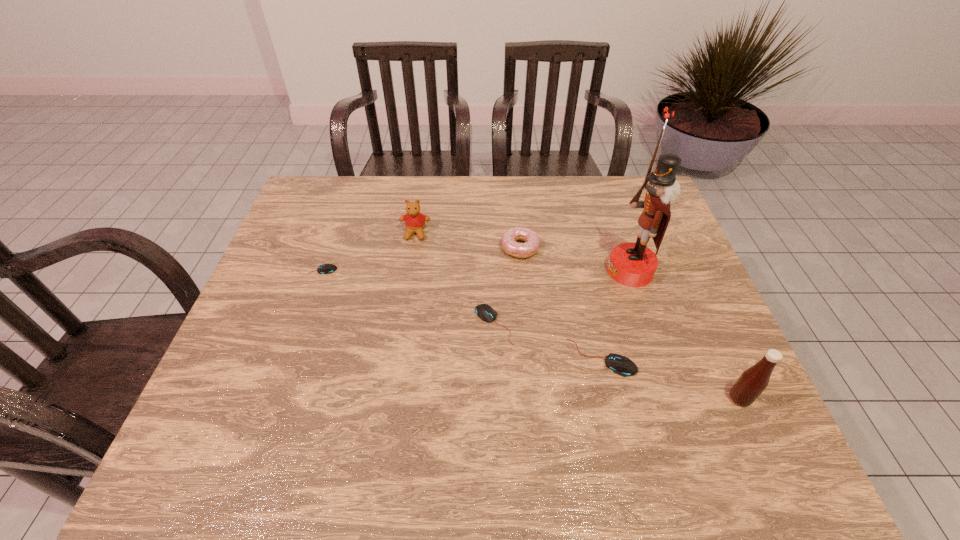
Where is `vacant space at the near left corner of the desktop`? This screenshot has width=960, height=540. vacant space at the near left corner of the desktop is located at coordinates (267, 401).

I want to click on blank space at the far right corner of the desktop, so click(x=629, y=189).

Where is `free space between the nutcracker and the leftmost object`? The height and width of the screenshot is (540, 960). free space between the nutcracker and the leftmost object is located at coordinates (472, 271).

Locate an element on the screen. This screenshot has height=540, width=960. empty space between the rightmost mouse and the rightmost object is located at coordinates (670, 378).

Find the location of a particular element. This screenshot has height=540, width=960. unoccupied position between the sixth tallest object and the fourth tallest object is located at coordinates (507, 286).

You are a GUI agent. You are given a task and a screenshot of the screen. Output one action in this format:
    pyautogui.click(x=<x>, y=<y>)
    Task: Click on the empty location between the rightmost mouse and the second mouse from left to right
    
    Given the screenshot: What is the action you would take?
    pyautogui.click(x=548, y=341)

The width and height of the screenshot is (960, 540). What are the coordinates of `free spot between the nutcracker and the nearest object` in the screenshot? It's located at (684, 335).

The image size is (960, 540). Identify the location of blank region between the farthest mouse and the second shortest mouse. (404, 298).

Where is `free space between the rightmost mouse and the nutcracker`? This screenshot has width=960, height=540. free space between the rightmost mouse and the nutcracker is located at coordinates (615, 314).

Identify the location of free area in between the leftmost mouse and the fourth tallest object. (418, 259).